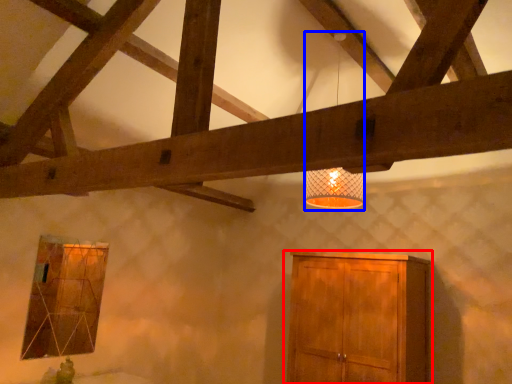
Question: Which of the following is the closest to the observer, cupboard (highlighted by a red box) or lamp (highlighted by a blue box)?

Choices:
 (A) cupboard
 (B) lamp

Answer: (B)